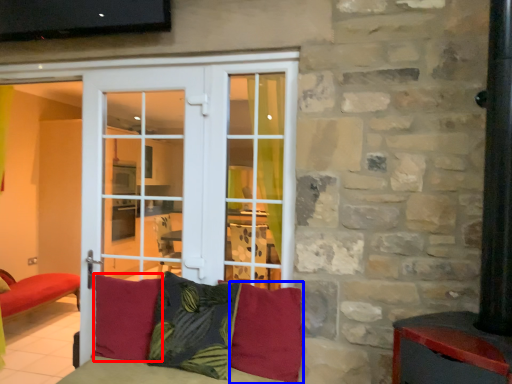
Question: Which object appears closest to the camera in this image, pillow (highlighted by a red box) or pillow (highlighted by a blue box)?

Choices:
 (A) pillow
 (B) pillow

Answer: (B)